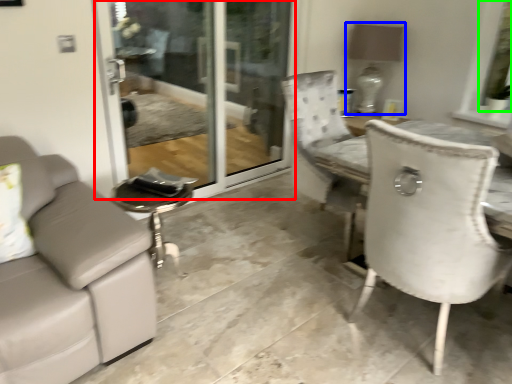
Question: Estimate the real-world distances between objects in this image. Which object is closer to screen door (highlighted by a red box), lamp (highlighted by a blue box) or window screen (highlighted by a green box)?

Choices:
 (A) lamp
 (B) window screen

Answer: (A)